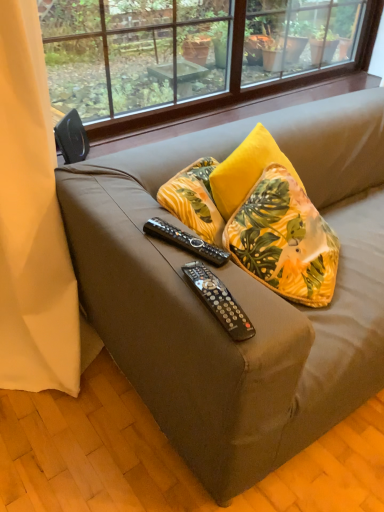
Question: Can you confirm if matte brown couch at center is positioned to the right of transparent glass window at upper center?

Choices:
 (A) yes
 (B) no

Answer: (A)

Question: Is matte brown couch at center positioned with its back to transparent glass window at upper center?

Choices:
 (A) no
 (B) yes

Answer: (A)

Question: Is matte brown couch at center next to transparent glass window at upper center?

Choices:
 (A) yes
 (B) no

Answer: (B)

Question: Is the depth of matte brown couch at center greater than that of transparent glass window at upper center?

Choices:
 (A) no
 (B) yes

Answer: (A)

Question: Does matte brown couch at center have a lesser height compared to transparent glass window at upper center?

Choices:
 (A) no
 (B) yes

Answer: (A)

Question: Is matte brown couch at center wider than transparent glass window at upper center?

Choices:
 (A) no
 (B) yes

Answer: (B)

Question: Is black plastic remote control at center, positioned as the 2th remote control in front-to-back order, located within yellow fabric pillow at upper right?

Choices:
 (A) no
 (B) yes

Answer: (A)

Question: Considering the relative sizes of yellow fabric pillow at upper right and black plastic remote control at center, which is the first remote control in top-to-bottom order, in the image provided, is yellow fabric pillow at upper right taller than black plastic remote control at center, which is the first remote control in top-to-bottom order,?

Choices:
 (A) no
 (B) yes

Answer: (B)

Question: Is there a large distance between yellow fabric pillow at upper right and black plastic remote control at center, which is the first remote control in top-to-bottom order?

Choices:
 (A) no
 (B) yes

Answer: (A)

Question: Can you confirm if yellow fabric pillow at upper right is shorter than black plastic remote control at center, which is the 2th remote control from bottom to top?

Choices:
 (A) yes
 (B) no

Answer: (B)

Question: Is yellow fabric pillow at upper right next to black plastic remote control at center, which is the 2th remote control from bottom to top?

Choices:
 (A) no
 (B) yes

Answer: (A)

Question: Is yellow fabric pillow at upper right wider than black plastic remote control at center, the 1th remote control in the back-to-front sequence?

Choices:
 (A) yes
 (B) no

Answer: (A)

Question: Is the position of matte brown couch at center more distant than that of black plastic remote control at center, positioned as the 2th remote control in front-to-back order?

Choices:
 (A) yes
 (B) no

Answer: (B)